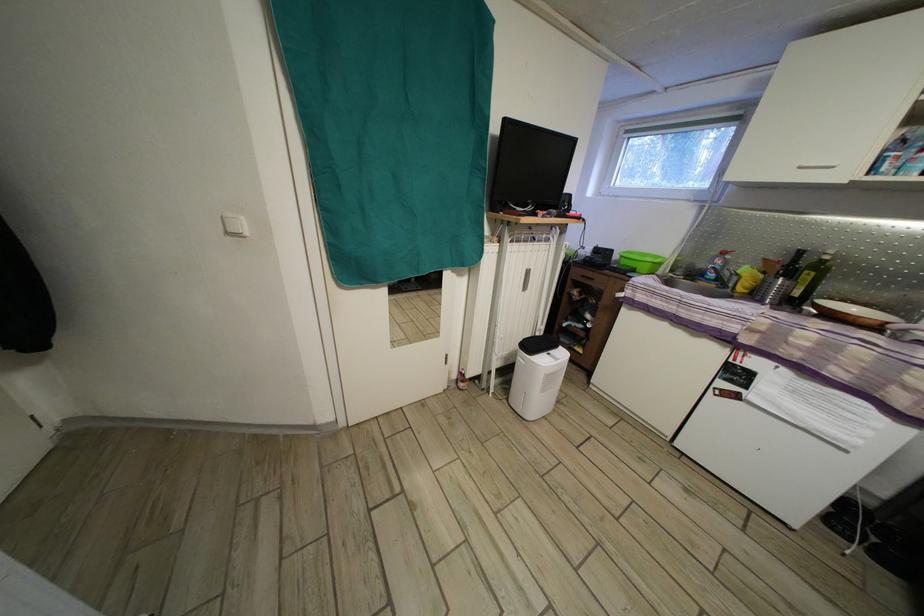
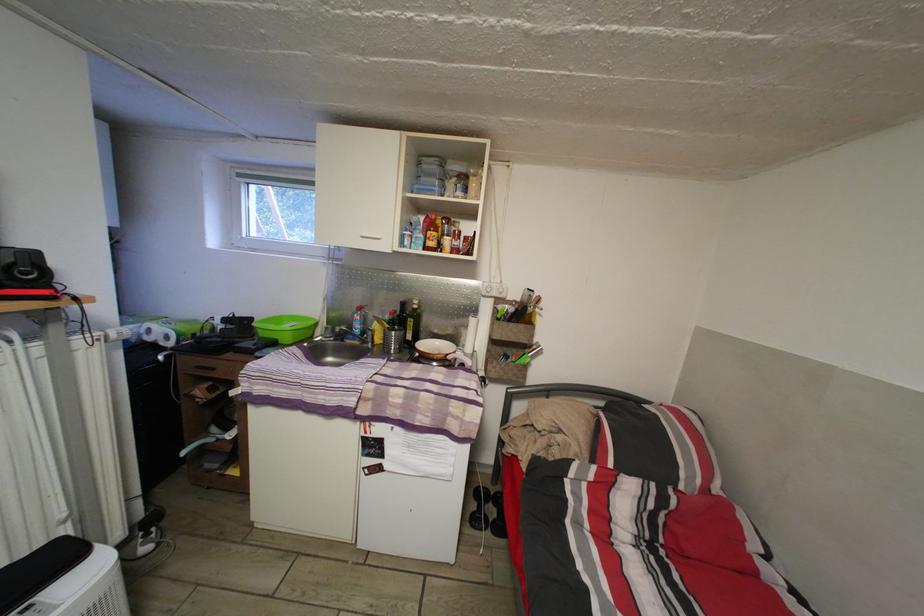
Where in the second image is the point corresponding to point (815, 282) from the first image?

(418, 329)